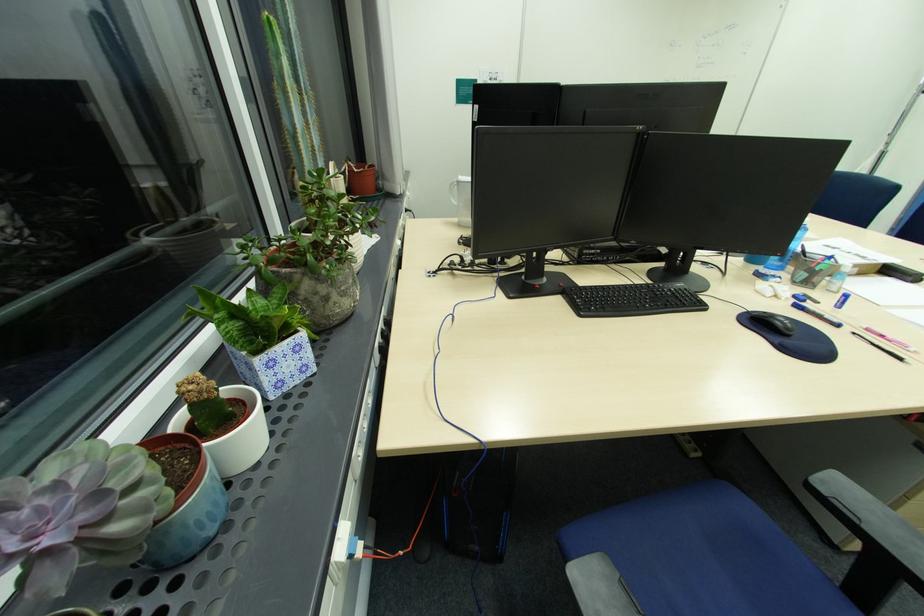
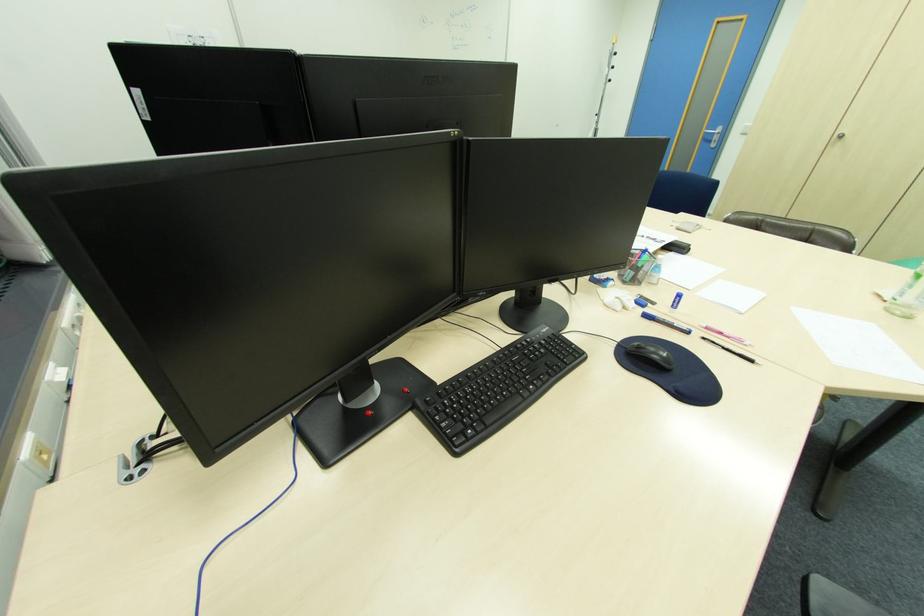
Where in the second image is the point corresponding to point 784,323 from the first image?

(662, 358)